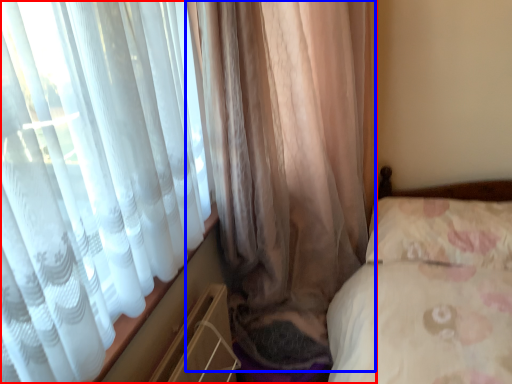
Question: Which object is closer to the camera taking this photo, curtain (highlighted by a red box) or curtain (highlighted by a blue box)?

Choices:
 (A) curtain
 (B) curtain

Answer: (A)